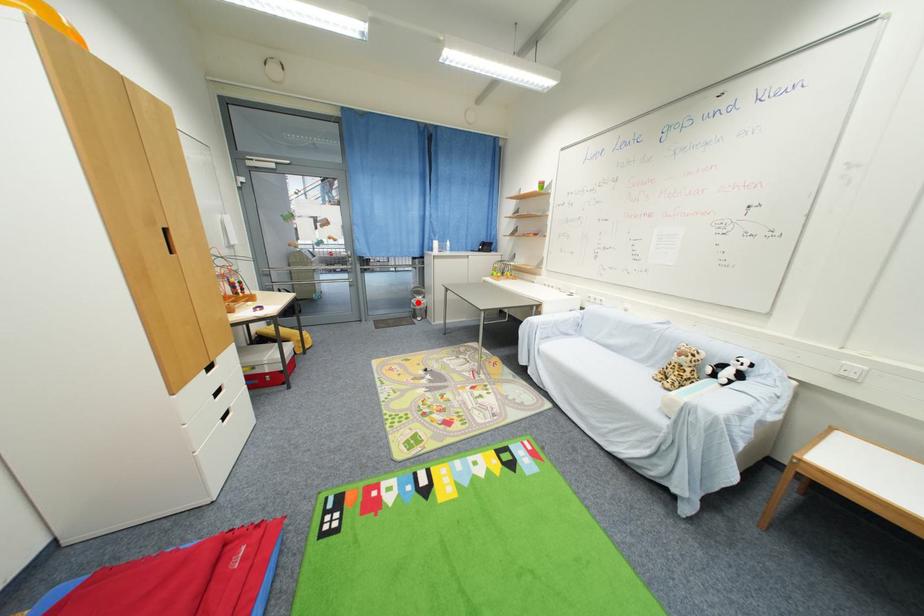
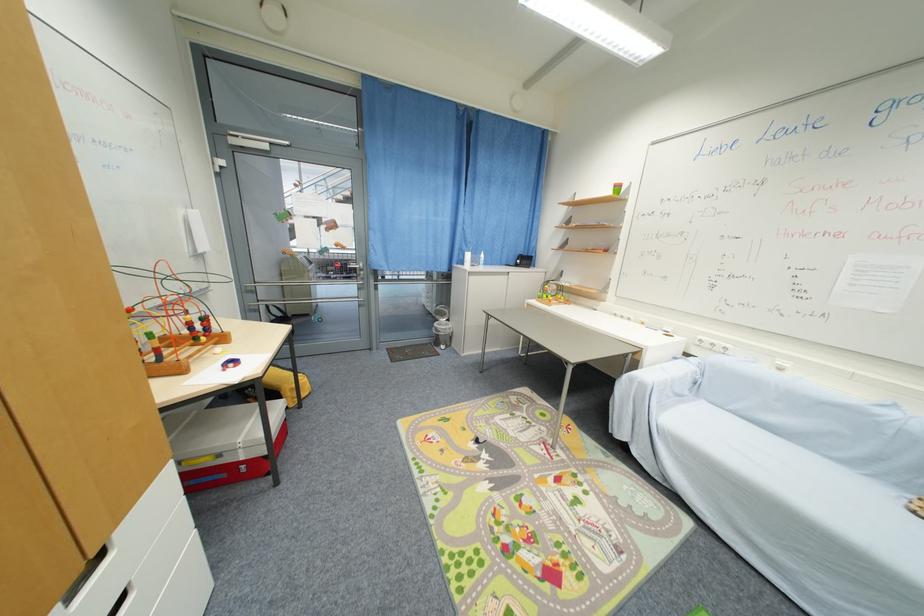
The point at the highlighted location is marked in the first image. Where is the corresponding point in the second image?

(441, 326)